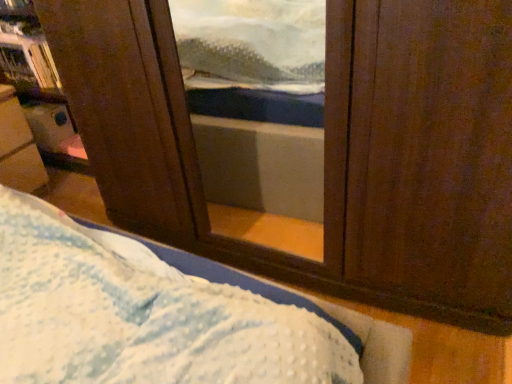
Question: Considering the relative sizes of wooden bookshelf at upper left and metallic silver tray at left in the image provided, is wooden bookshelf at upper left smaller than metallic silver tray at left?

Choices:
 (A) no
 (B) yes

Answer: (B)

Question: Is wooden bookshelf at upper left to the left of metallic silver tray at left from the viewer's perspective?

Choices:
 (A) yes
 (B) no

Answer: (B)

Question: Does wooden bookshelf at upper left have a greater height compared to metallic silver tray at left?

Choices:
 (A) no
 (B) yes

Answer: (A)

Question: Does wooden bookshelf at upper left lie behind metallic silver tray at left?

Choices:
 (A) yes
 (B) no

Answer: (A)

Question: Does wooden bookshelf at upper left turn towards metallic silver tray at left?

Choices:
 (A) yes
 (B) no

Answer: (B)

Question: Is wooden bookshelf at upper left facing away from metallic silver tray at left?

Choices:
 (A) yes
 (B) no

Answer: (B)

Question: Considering the relative sizes of metallic silver tray at left and wooden bookshelf at upper left in the image provided, is metallic silver tray at left thinner than wooden bookshelf at upper left?

Choices:
 (A) no
 (B) yes

Answer: (A)

Question: Can you confirm if metallic silver tray at left is taller than wooden bookshelf at upper left?

Choices:
 (A) yes
 (B) no

Answer: (A)

Question: From a real-world perspective, is metallic silver tray at left on wooden bookshelf at upper left?

Choices:
 (A) yes
 (B) no

Answer: (B)

Question: Is metallic silver tray at left far from wooden bookshelf at upper left?

Choices:
 (A) yes
 (B) no

Answer: (B)

Question: Is wooden bookshelf at upper left inside metallic silver tray at left?

Choices:
 (A) no
 (B) yes

Answer: (A)

Question: Is metallic silver tray at left at the right side of wooden bookshelf at upper left?

Choices:
 (A) no
 (B) yes

Answer: (A)

Question: Is wooden bookshelf at upper left wider or thinner than metallic silver tray at left?

Choices:
 (A) wide
 (B) thin

Answer: (B)